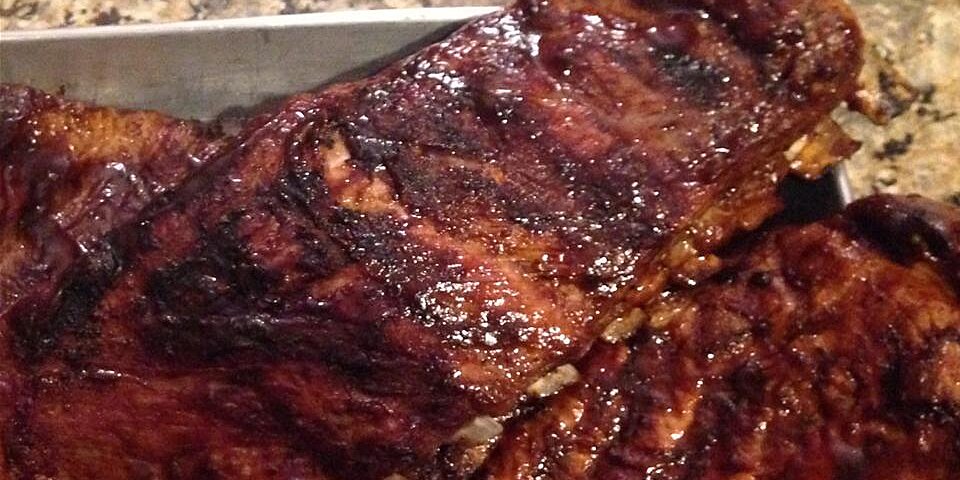
Image resolution: width=960 pixels, height=480 pixels. I want to click on steel tray, so click(180, 68), click(824, 179).